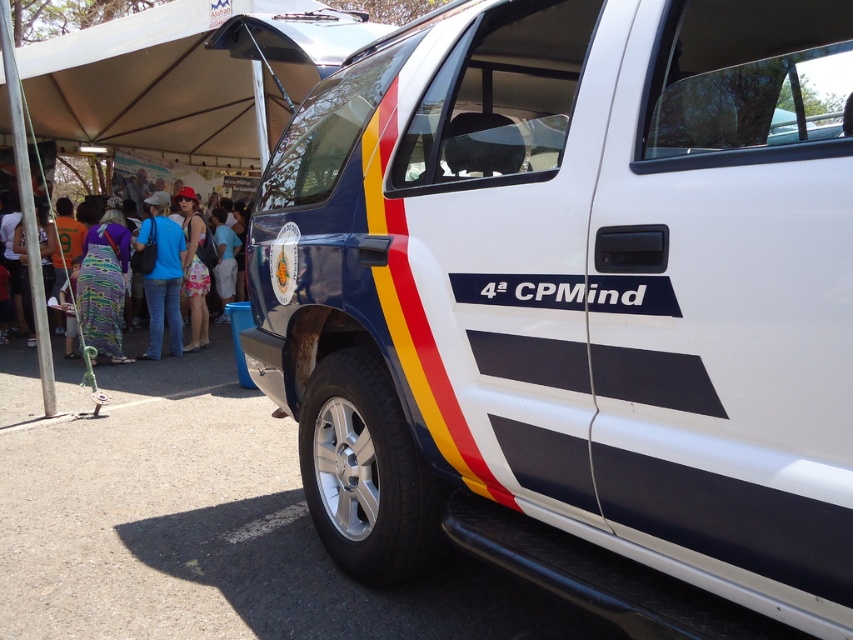
You are a photographer at the event and want to capture a photo that includes both the blue jeans at center and the printed fabric dress at left. Which one should you focus on to ensure both are in the frame?

The blue jeans at center is in front of the printed fabric dress at left, so focusing on the blue jeans at center will ensure both are in the frame as the dress is behind it.

You are standing at the entrance of the canopy tent and see the point marked at coordinates (577, 305). What object is located at that point?

The point at coordinates (577, 305) corresponds to the white glossy police van at center.

You are a photographer at the event and need to capture both the white glossy police van at center and the printed fabric dress at left in the same frame. Which object should you position closer to the edge of the frame to include both?

To include both the white glossy police van at center and the printed fabric dress at left in the same frame, position the printed fabric dress at left closer to the edge of the frame since it is to the left of the white glossy police van at center.